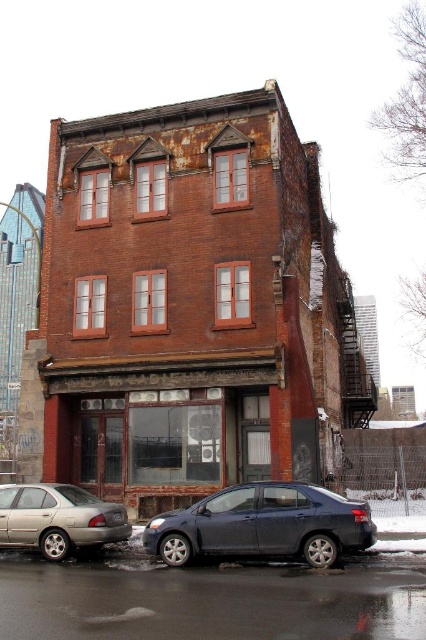
Question: Which point appears closest to the camera in this image?

Choices:
 (A) (247, 556)
 (B) (45, 513)

Answer: (A)

Question: Can you confirm if satin dark blue sedan at lower center is thinner than silver metallic sedan at lower left?

Choices:
 (A) yes
 (B) no

Answer: (B)

Question: Considering the relative positions of satin dark blue sedan at lower center and silver metallic sedan at lower left in the image provided, where is satin dark blue sedan at lower center located with respect to silver metallic sedan at lower left?

Choices:
 (A) above
 (B) below

Answer: (A)

Question: Which point is closer to the camera?

Choices:
 (A) silver metallic sedan at lower left
 (B) satin dark blue sedan at lower center

Answer: (B)

Question: Can you confirm if satin dark blue sedan at lower center is positioned above silver metallic sedan at lower left?

Choices:
 (A) no
 (B) yes

Answer: (B)

Question: Which of the following is the closest to the observer?

Choices:
 (A) silver metallic sedan at lower left
 (B) satin dark blue sedan at lower center

Answer: (B)